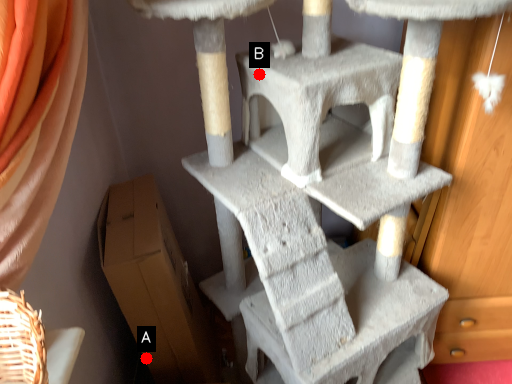
Question: Two points are circled on the image, labeled by A and B beside each circle. Which point is farther from the camera taking this photo?

Choices:
 (A) A is further
 (B) B is further

Answer: (A)